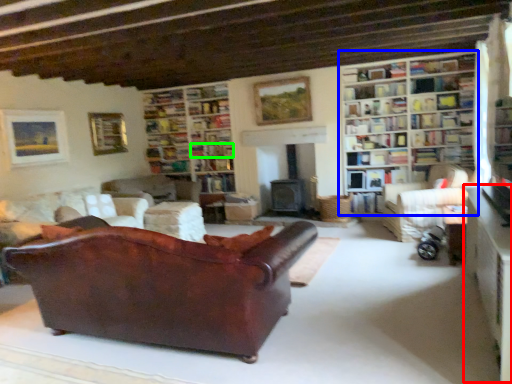
Question: Which is farther away from table (highlighted by a red box)? bookcase (highlighted by a blue box) or book (highlighted by a green box)?

Choices:
 (A) bookcase
 (B) book

Answer: (B)